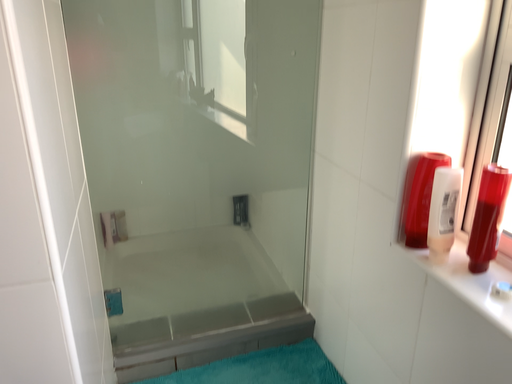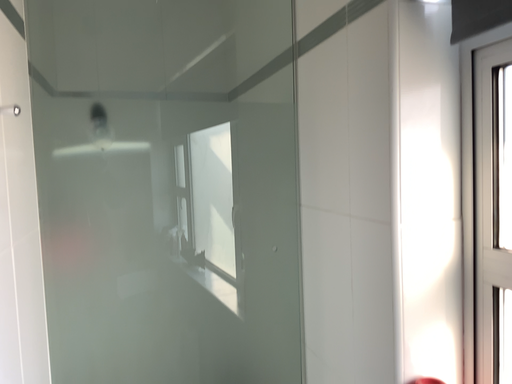
Question: Which way did the camera rotate in the video?

Choices:
 (A) rotated downward
 (B) rotated upward

Answer: (B)